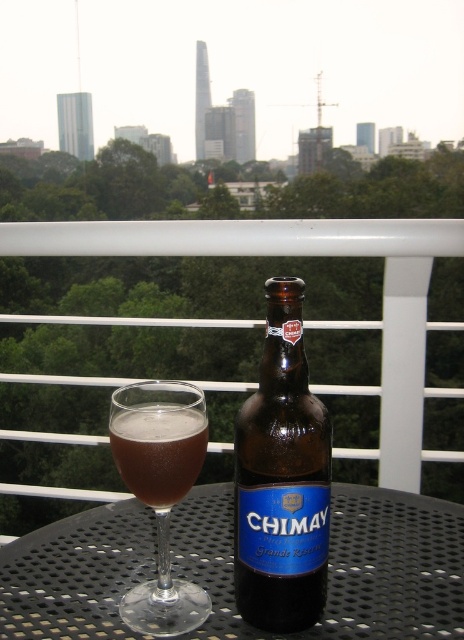
Who is positioned more to the right, black metal table at center or brown glass bottle at center?

Positioned to the right is brown glass bottle at center.

Does black metal table at center come in front of brown glass bottle at center?

No, black metal table at center is behind brown glass bottle at center.

Find the location of `black metal table at center`. black metal table at center is located at coordinates (341, 564).

Which of these two, brown glass bottle at center or transparent glass at center, stands shorter?

With less height is transparent glass at center.

Locate an element on the screen. The height and width of the screenshot is (640, 464). brown glass bottle at center is located at coordinates tap(282, 477).

Can you confirm if brown glass bottle at center is thinner than brown glass at center?

Yes, brown glass bottle at center is thinner than brown glass at center.

Does brown glass bottle at center appear over brown glass at center?

No, brown glass bottle at center is not above brown glass at center.

Locate an element on the screen. brown glass bottle at center is located at coordinates (282, 477).